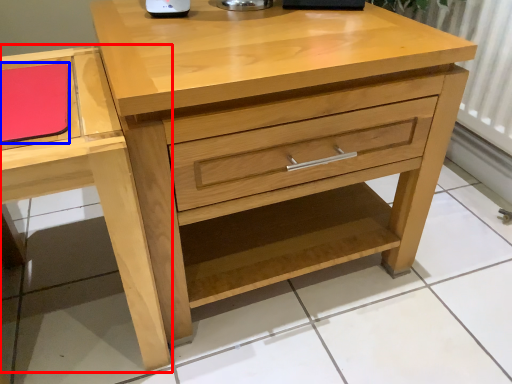
Question: Which of the following is the farthest to the observer, vanity (highlighted by a red box) or notepad (highlighted by a blue box)?

Choices:
 (A) vanity
 (B) notepad

Answer: (B)